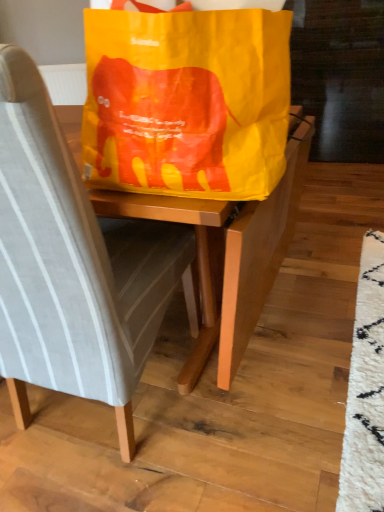
Question: Considering their positions, is light gray fabric chair at center located in front of or behind yellow paper grocery bag at center?

Choices:
 (A) behind
 (B) front

Answer: (B)

Question: From a real-world perspective, relative to yellow paper grocery bag at center, is light gray fabric chair at center vertically above or below?

Choices:
 (A) above
 (B) below

Answer: (B)

Question: Would you say light gray fabric chair at center is to the left or to the right of yellow paper grocery bag at center in the picture?

Choices:
 (A) left
 (B) right

Answer: (A)

Question: From a real-world perspective, relative to light gray fabric chair at center, is yellow paper grocery bag at center vertically above or below?

Choices:
 (A) below
 (B) above

Answer: (B)

Question: Is yellow paper grocery bag at center in front of or behind light gray fabric chair at center in the image?

Choices:
 (A) front
 (B) behind

Answer: (B)

Question: From the image's perspective, is yellow paper grocery bag at center positioned above or below light gray fabric chair at center?

Choices:
 (A) above
 (B) below

Answer: (A)

Question: Is point (152, 144) closer or farther from the camera than point (99, 254)?

Choices:
 (A) farther
 (B) closer

Answer: (B)